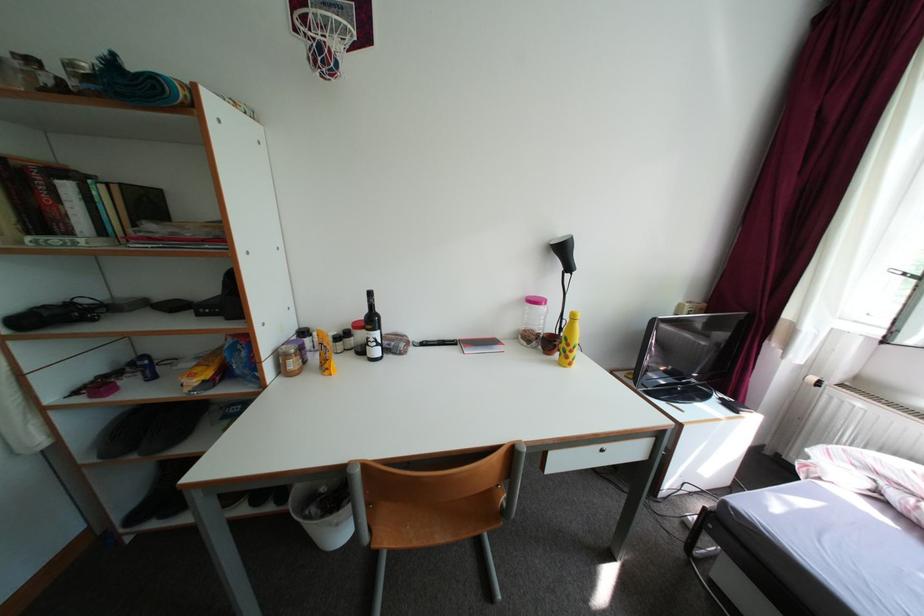
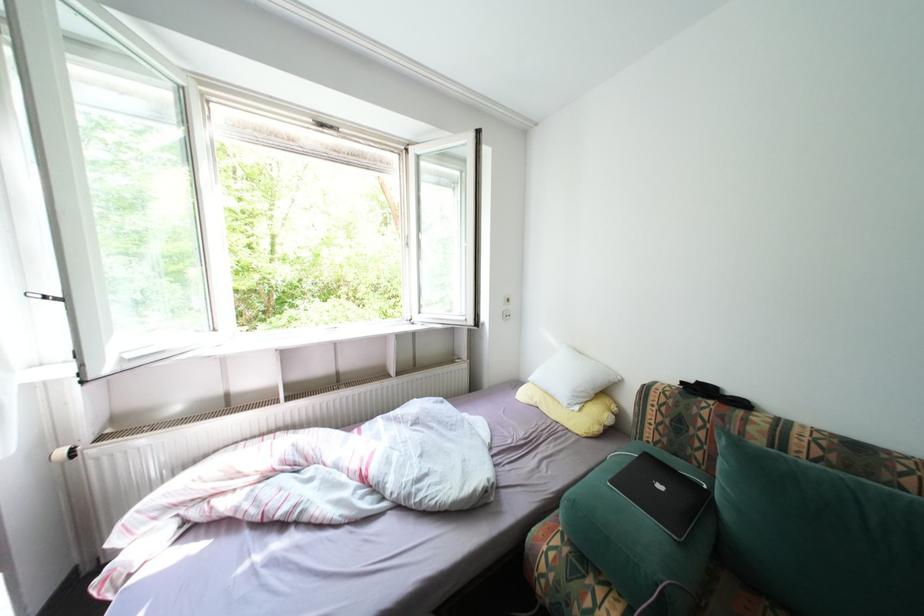
Based on the continuous images, in which direction is the camera rotating?

The camera rotated toward right-down.